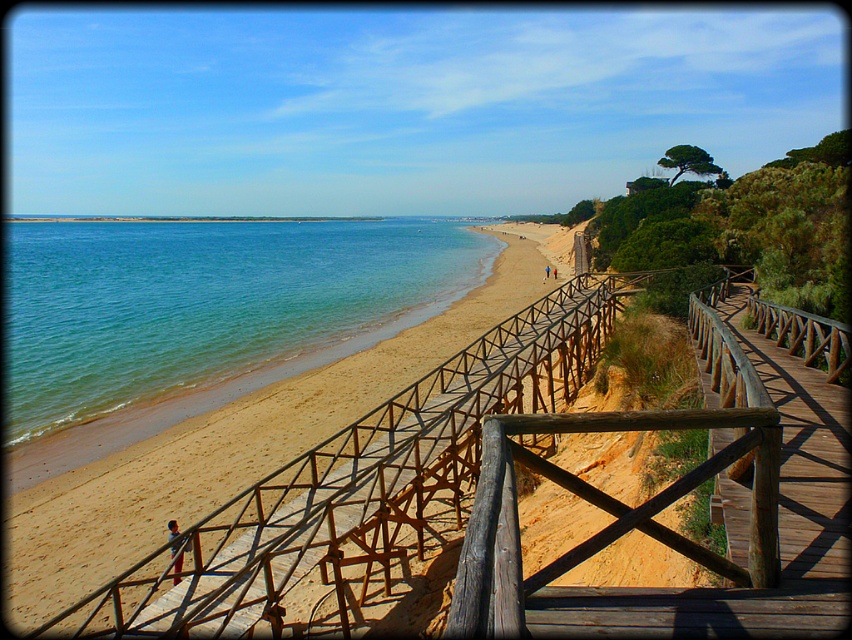
Who is shorter, greenish-blue water at beach left or sandy beach at center?

sandy beach at center is shorter.

Does greenish-blue water at beach left have a lesser width compared to sandy beach at center?

No, greenish-blue water at beach left is not thinner than sandy beach at center.

Between point (208, 326) and point (159, 461), which one is positioned behind?

The point (208, 326) is behind.

Where is `greenish-blue water at beach left`? greenish-blue water at beach left is located at coordinates (206, 307).